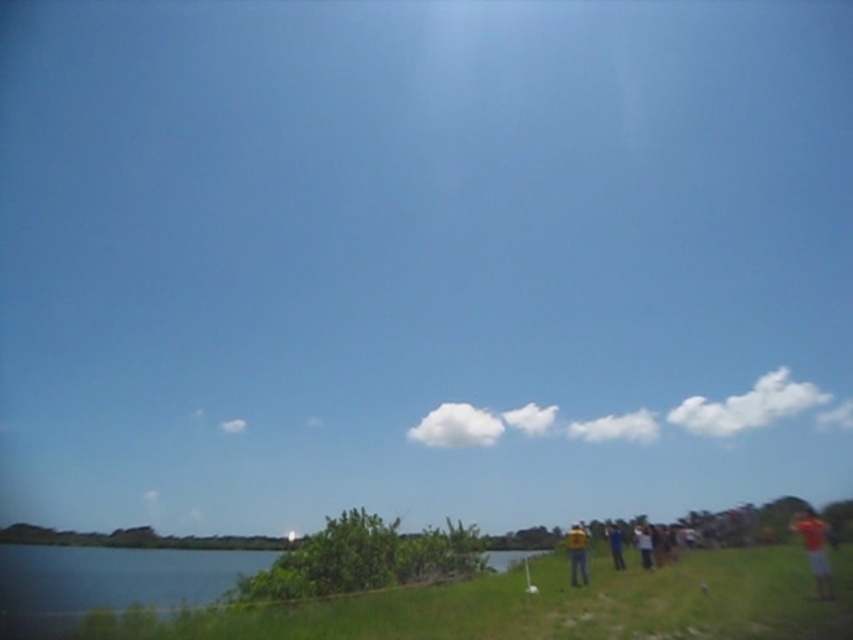
Question: Does orange t-shirt at right appear on the left side of white cotton shirt at lower right?

Choices:
 (A) yes
 (B) no

Answer: (B)

Question: Does orange t-shirt at right appear over white cotton shirt at lower right?

Choices:
 (A) no
 (B) yes

Answer: (B)

Question: Which of the following is the closest to the observer?

Choices:
 (A) yellow fabric person at lower right
 (B) yellow shirt at lower right
 (C) white cotton shirt at lower right

Answer: (A)

Question: Among these objects, which one is farthest from the camera?

Choices:
 (A) yellow fabric person at lower right
 (B) white cotton shirt at lower right

Answer: (B)

Question: Does yellow fabric person at lower right have a larger size compared to yellow shirt at lower right?

Choices:
 (A) no
 (B) yes

Answer: (B)

Question: Among these points, which one is nearest to the camera?

Choices:
 (A) (619, 561)
 (B) (642, 545)
 (C) (582, 538)

Answer: (C)